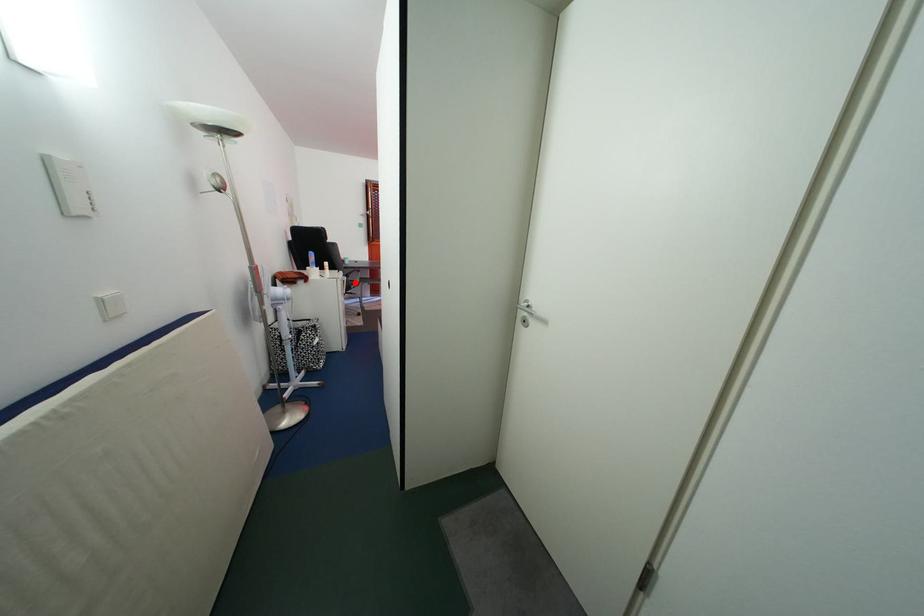
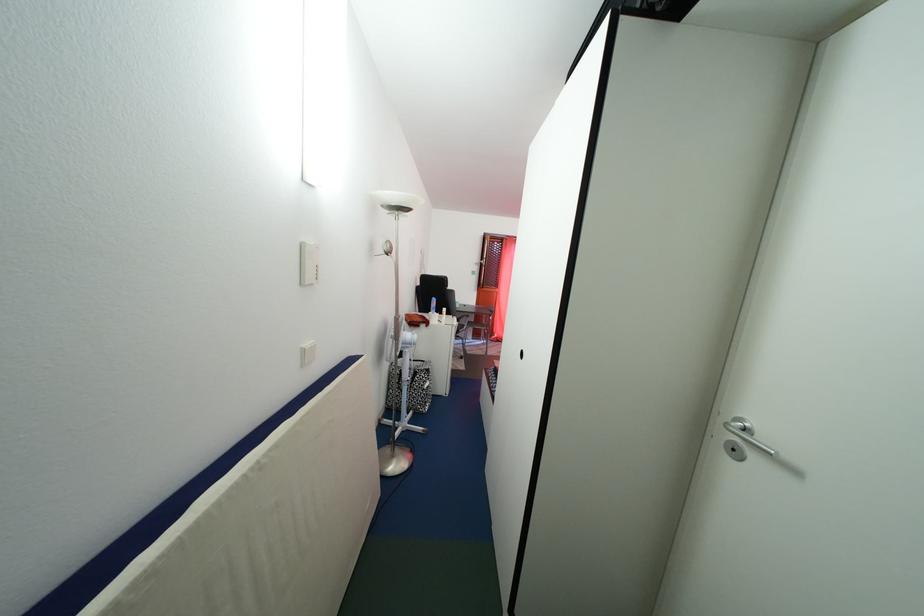
Where in the second image is the point corresponding to the highlighted location from the first image?

(467, 328)